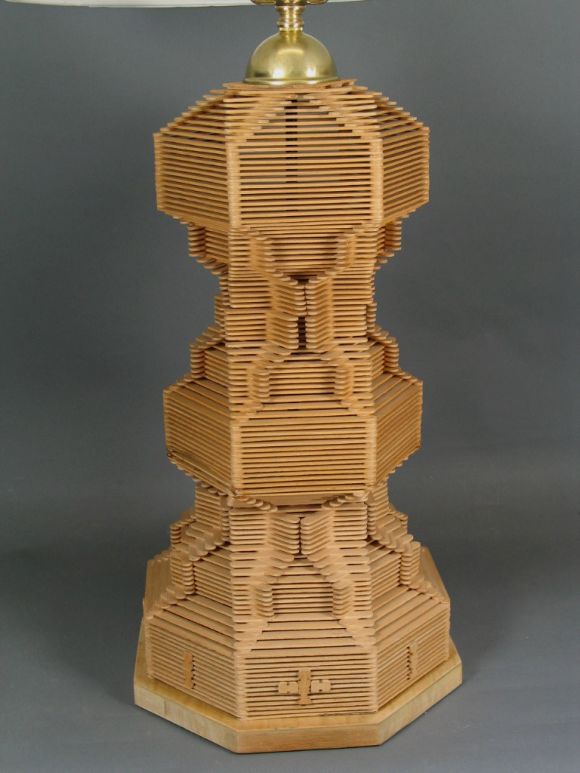
This screenshot has width=580, height=773. Identify the location of wood design. (336, 678).